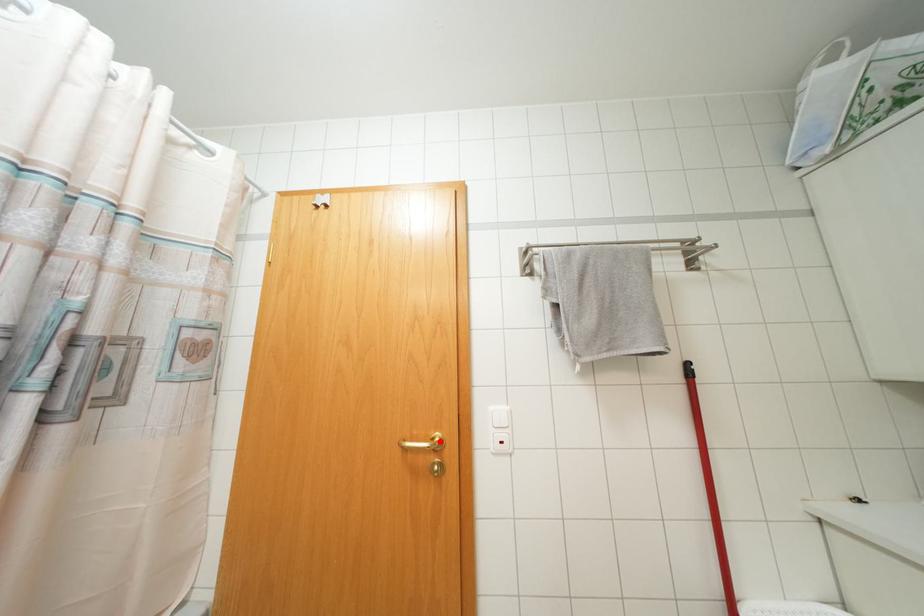
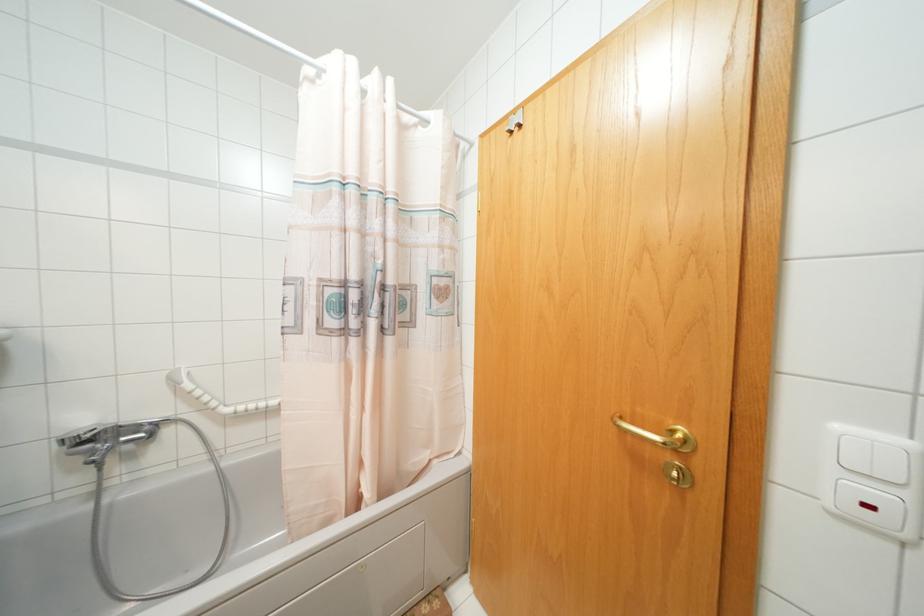
Where in the second image is the point corresponding to the highlighted location from the first image?

(686, 440)